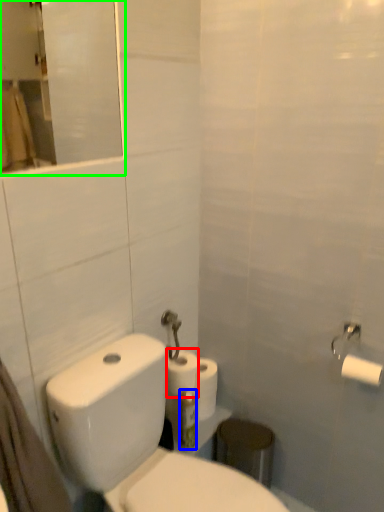
Question: Which is nearer to the toilet paper (highlighted by a red box)? toothbrush (highlighted by a blue box) or mirror (highlighted by a green box).

Choices:
 (A) toothbrush
 (B) mirror

Answer: (A)